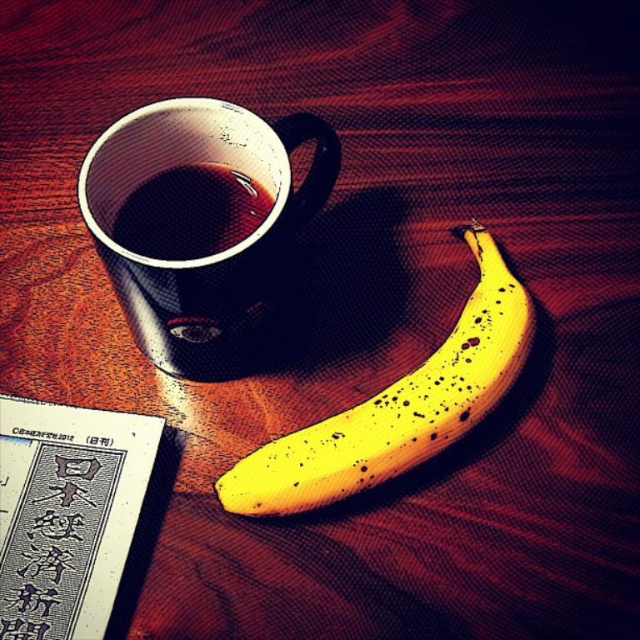
Between point (321, 497) and point (173, 253), which one is positioned behind?

Positioned behind is point (173, 253).

Find the location of a particular element. yellow matte banana at center is located at coordinates (397, 404).

At what (x,y) coordinates should I click in order to perform the action: click on yellow matte banana at center. Please return your answer as a coordinate pair (x, y). The height and width of the screenshot is (640, 640). Looking at the image, I should click on (397, 404).

Who is taller, matte black mug at upper left or yellow matte banana at center?

Standing taller between the two is yellow matte banana at center.

Between point (150, 129) and point (412, 442), which one is positioned behind?

Positioned behind is point (150, 129).

Is point (157, 250) positioned in front of point (404, 460)?

No, (157, 250) is behind (404, 460).

Locate an element on the screen. The width and height of the screenshot is (640, 640). matte black mug at upper left is located at coordinates (202, 225).

Who is positioned more to the right, matte black mug at upper left or shiny black cup at upper left?

Positioned to the right is matte black mug at upper left.

Which is in front, point (168, 147) or point (227, 196)?

Positioned in front is point (168, 147).

Does point (122, 144) lie behind point (145, 192)?

That is False.

Where is `matte black mug at upper left`? This screenshot has width=640, height=640. matte black mug at upper left is located at coordinates (202, 225).